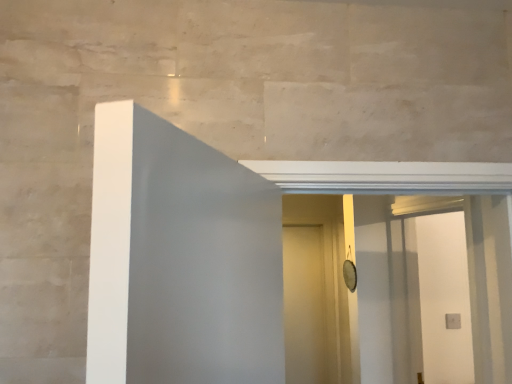
Describe the element at coordinates (304, 304) in the screenshot. I see `white matte door at center` at that location.

This screenshot has width=512, height=384. Find the location of `white matte door at center`. white matte door at center is located at coordinates (304, 304).

Describe the element at coordinates (431, 299) in the screenshot. I see `white glossy screen door at center` at that location.

This screenshot has width=512, height=384. I want to click on white glossy screen door at center, so click(x=431, y=299).

In order to click on white matte door at center in this screenshot , I will do [304, 304].

Between white matte door at center and white glossy screen door at center, which one appears on the left side from the viewer's perspective?

white matte door at center.

From the picture: Considering their positions, is white matte door at center located in front of or behind white glossy screen door at center?

white matte door at center is positioned farther from the viewer than white glossy screen door at center.

Is point (294, 232) more distant than point (421, 244)?

Yes, it is behind point (421, 244).

From the image's perspective, is white matte door at center above white glossy screen door at center?

No, from the image's perspective, white matte door at center is not over white glossy screen door at center.

Based on the photo, from a real-world perspective, is white matte door at center located higher than white glossy screen door at center?

No, from a real-world perspective, white matte door at center is not above white glossy screen door at center.

Considering the relative sizes of white matte door at center and white glossy screen door at center in the image provided, is white matte door at center thinner than white glossy screen door at center?

Indeed, white matte door at center has a lesser width compared to white glossy screen door at center.

Considering the relative sizes of white matte door at center and white glossy screen door at center in the image provided, is white matte door at center shorter than white glossy screen door at center?

In fact, white matte door at center may be taller than white glossy screen door at center.

In terms of size, does white matte door at center appear bigger or smaller than white glossy screen door at center?

white matte door at center is smaller than white glossy screen door at center.

Do you think white matte door at center is within white glossy screen door at center, or outside of it?

white matte door at center exists outside the volume of white glossy screen door at center.

In the scene shown: Is white matte door at center touching white glossy screen door at center?

white matte door at center and white glossy screen door at center are clearly separated.

Is white matte door at center oriented away from white glossy screen door at center?

white matte door at center does not have its back to white glossy screen door at center.

Based on the photo, measure the distance from white matte door at center to white glossy screen door at center.

The distance of white matte door at center from white glossy screen door at center is 4.25 feet.

Image resolution: width=512 pixels, height=384 pixels. I want to click on door below the white glossy screen door at center (from the image's perspective), so click(304, 304).

Does white glossy screen door at center appear on the left side of white matte door at center?

No, white glossy screen door at center is not to the left of white matte door at center.

Which object is further away from the camera, white glossy screen door at center or white matte door at center?

white matte door at center is more distant.

Is point (448, 346) closer or farther from the camera than point (312, 339)?

Clearly, point (448, 346) is closer to the camera than point (312, 339).

From the image's perspective, between white glossy screen door at center and white matte door at center, which one is located above?

white glossy screen door at center.

From a real-world perspective, is white glossy screen door at center physically below white matte door at center?

Incorrect, from a real-world perspective, white glossy screen door at center is higher than white matte door at center.

Is white glossy screen door at center wider than white matte door at center?

Yes.

Considering the sizes of objects white glossy screen door at center and white matte door at center in the image provided, who is shorter, white glossy screen door at center or white matte door at center?

white glossy screen door at center is shorter.

Can you confirm if white glossy screen door at center is bigger than white matte door at center?

Yes.

Is white glossy screen door at center located outside white matte door at center?

Yes, white glossy screen door at center is not within white matte door at center.

Is white glossy screen door at center beside white matte door at center?

white glossy screen door at center and white matte door at center are not in contact.

Is white glossy screen door at center facing towards white matte door at center?

No.

In the image, there is a white glossy screen door at center. Identify the location of door below it (from the image's perspective). The image size is (512, 384). (304, 304).

Identify the location of door on the left of white glossy screen door at center. (304, 304).

At what (x,y) coordinates should I click in order to perform the action: click on door below the white glossy screen door at center (from the image's perspective). Please return your answer as a coordinate pair (x, y). The image size is (512, 384). Looking at the image, I should click on (304, 304).